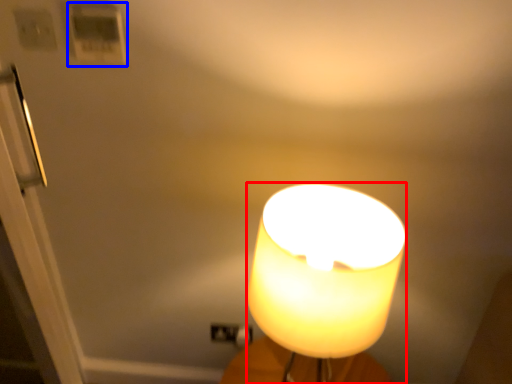
Question: Which object appears farthest to the camera in this image, lamp (highlighted by a red box) or light switch (highlighted by a blue box)?

Choices:
 (A) lamp
 (B) light switch

Answer: (B)